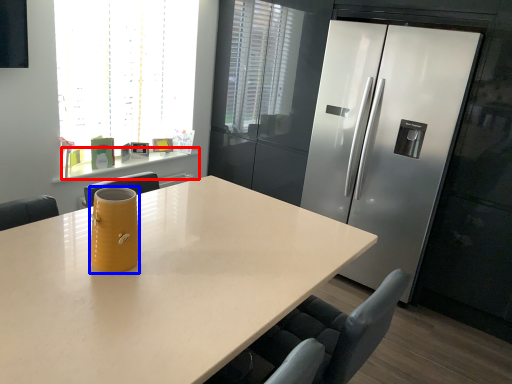
Question: Which object appears farthest to the camera in this image, counter (highlighted by a red box) or jug (highlighted by a blue box)?

Choices:
 (A) counter
 (B) jug

Answer: (A)